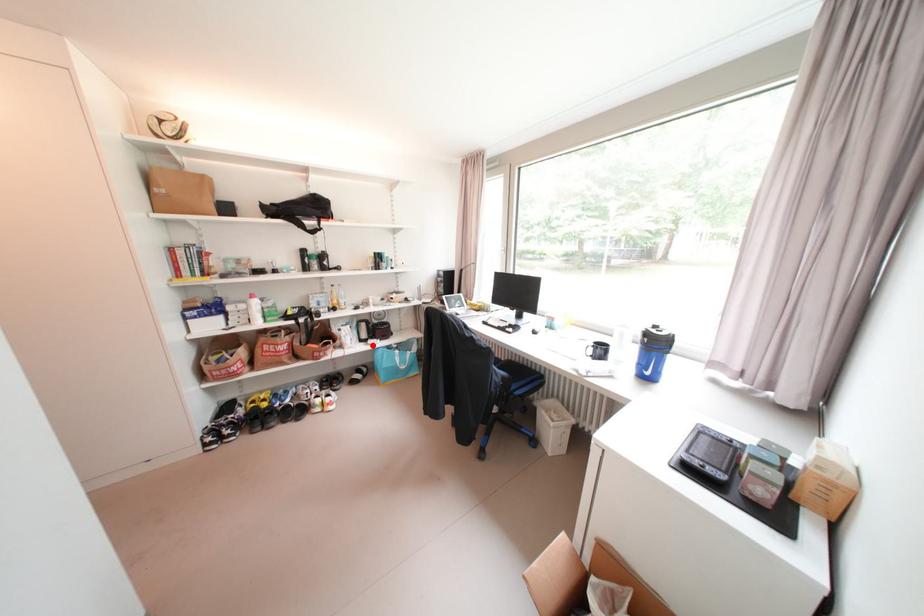
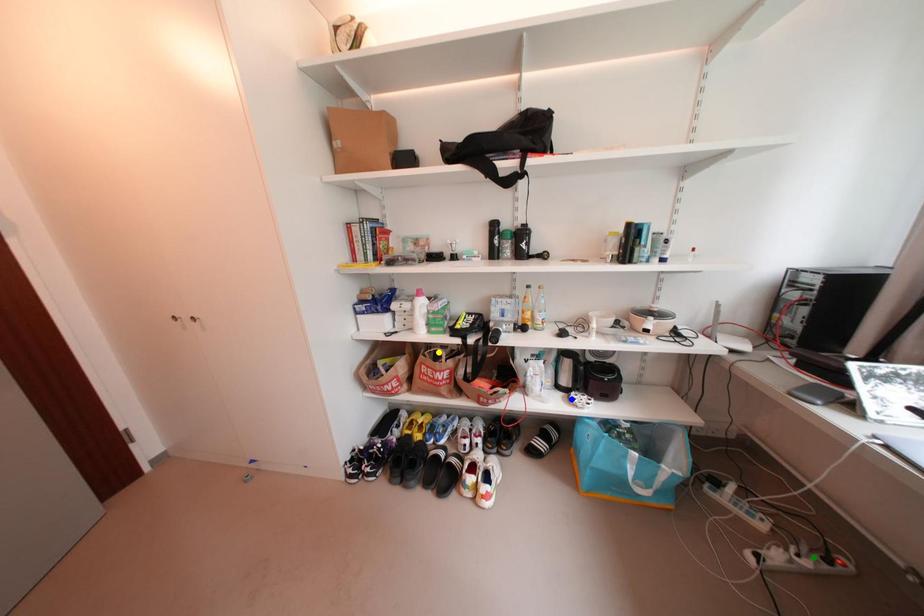
Question: I am providing you with two images of the same scene from different viewpoints. A red point is marked on the first image. You are given multiple points on the second image. Which spot in image 2 lines up with the point in image 1?

Choices:
 (A) yellow point
 (B) blue point
 (C) green point

Answer: (B)